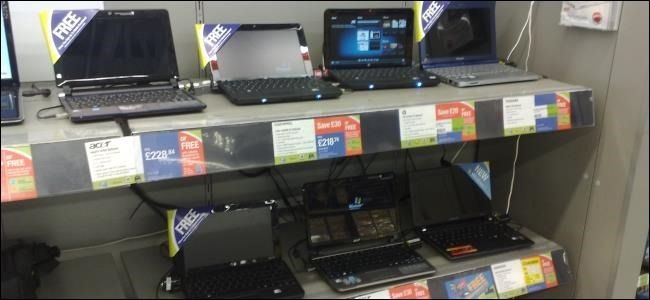
Where is `screens`? screens is located at coordinates (131, 50), (244, 51), (381, 39), (454, 34), (448, 192), (348, 216), (248, 229).